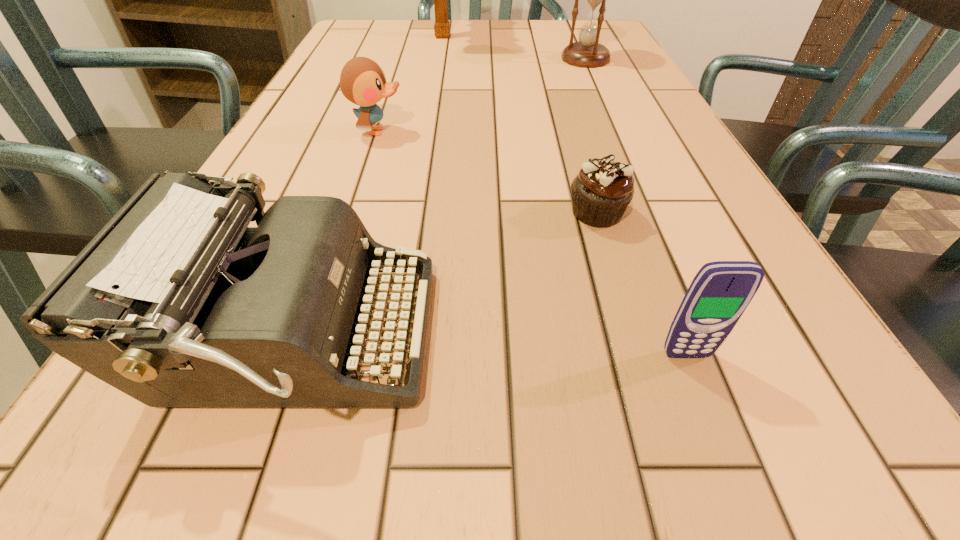
Image resolution: width=960 pixels, height=540 pixels. I want to click on vacant region located on the front-facing side of the cellular telephone, so click(733, 477).

The image size is (960, 540). What are the coordinates of `vacant space located on the front-facing side of the third farthest object` in the screenshot? It's located at (532, 131).

At what (x,y) coordinates should I click in order to perform the action: click on vacant space situated on the back of the shortest object. Please return your answer as a coordinate pair (x, y). This screenshot has width=960, height=540. Looking at the image, I should click on (575, 140).

The image size is (960, 540). Find the location of `object that is at the far edge`. object that is at the far edge is located at coordinates tap(441, 27).

Where is `typewriter positioned at the left edge`? This screenshot has height=540, width=960. typewriter positioned at the left edge is located at coordinates (176, 302).

Locate an element on the screen. duck situated at the left edge is located at coordinates (362, 81).

I want to click on hourglass present at the right edge, so click(587, 53).

Where is `cellular telephone located in the right edge section of the desktop`? Image resolution: width=960 pixels, height=540 pixels. cellular telephone located in the right edge section of the desktop is located at coordinates (721, 291).

You are a GUI agent. You are given a task and a screenshot of the screen. Output one action in this format:
    pyautogui.click(x=<x>, y=<y>)
    Task: Click on the free space at the far edge of the desktop
    
    Given the screenshot: What is the action you would take?
    pyautogui.click(x=405, y=31)

The image size is (960, 540). Find the location of `vacant area at the left edge`. vacant area at the left edge is located at coordinates (203, 438).